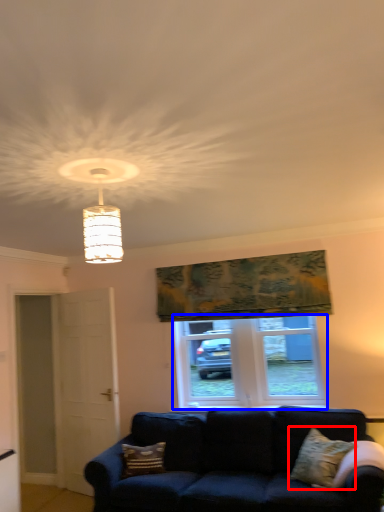
Question: Which of the following is the closest to the observer, pillow (highlighted by a red box) or window (highlighted by a blue box)?

Choices:
 (A) pillow
 (B) window

Answer: (A)